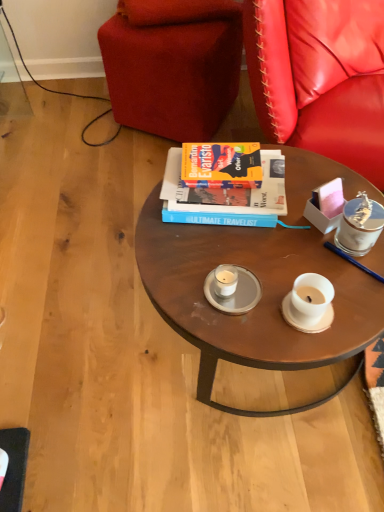
Locate an element on the screen. free spot behind white matte candle at center, which is the second coffee cup from top to bottom is located at coordinates (229, 239).